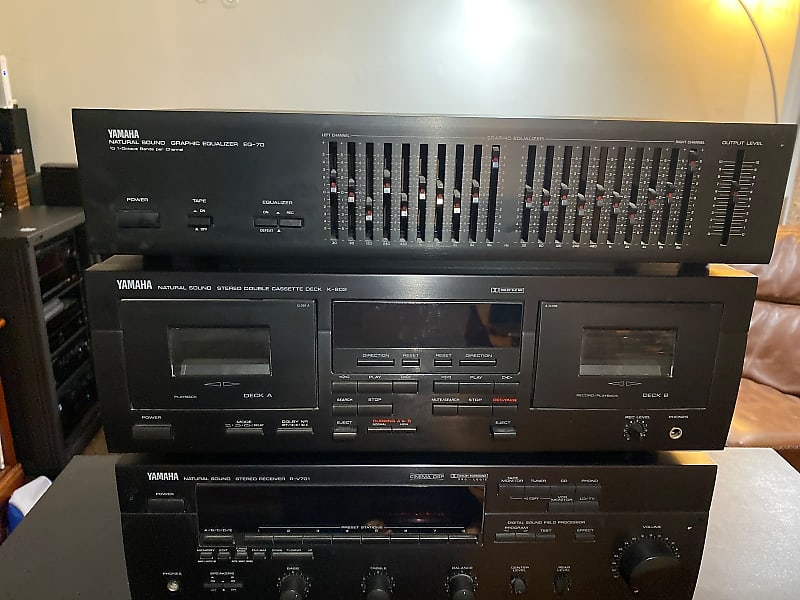
Where is `wall`? The image size is (800, 600). wall is located at coordinates (266, 36).